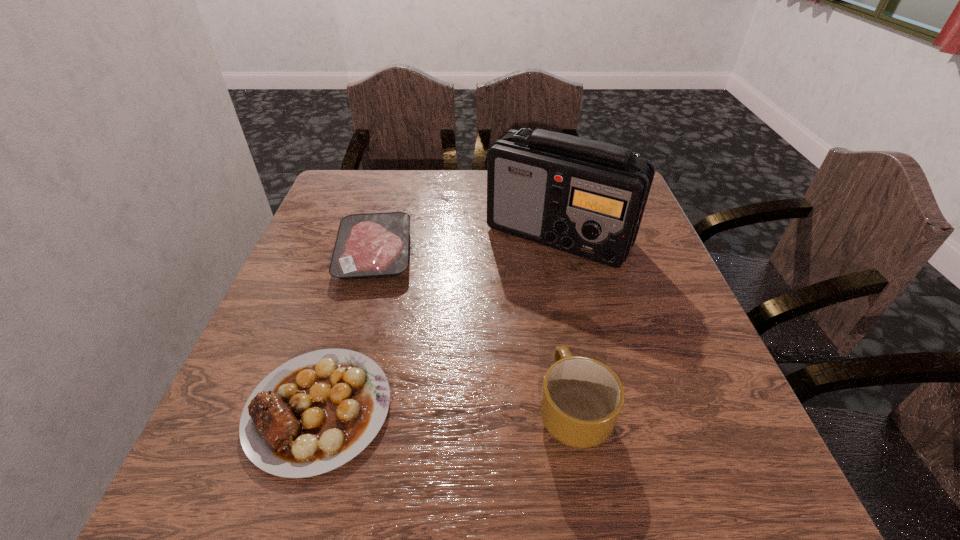
The width and height of the screenshot is (960, 540). In the image, there is a desktop. Find the location of `vacant area at the left edge`. vacant area at the left edge is located at coordinates point(308,265).

This screenshot has width=960, height=540. In the image, there is a desktop. Find the location of `free space at the right edge`. free space at the right edge is located at coordinates (685, 312).

In the image, there is a desktop. At what (x,y) coordinates should I click in order to perform the action: click on vacant space at the far left corner. Please return your answer as a coordinate pair (x, y). The height and width of the screenshot is (540, 960). Looking at the image, I should click on (357, 178).

Locate an element on the screen. This screenshot has width=960, height=540. vacant space at the near left corner is located at coordinates (234, 468).

Locate an element on the screen. Image resolution: width=960 pixels, height=540 pixels. unoccupied position between the radio receiver and the nearer steak is located at coordinates (439, 322).

Where is `free spot between the tallest object and the mug`? free spot between the tallest object and the mug is located at coordinates (565, 322).

The image size is (960, 540). What are the coordinates of `empty location between the farther steak and the third shortest object` in the screenshot? It's located at (473, 331).

Image resolution: width=960 pixels, height=540 pixels. I want to click on free point between the shorter steak and the second tallest object, so click(473, 331).

Find the location of a particular element. Image resolution: width=960 pixels, height=540 pixels. free space between the mug and the radio receiver is located at coordinates (565, 322).

You are a GUI agent. You are given a task and a screenshot of the screen. Output one action in this format:
    pyautogui.click(x=<x>, y=<y>)
    Task: Click on the vacant space in between the nearer steak and the shortest object
    The height and width of the screenshot is (540, 960).
    Given the screenshot: What is the action you would take?
    pyautogui.click(x=347, y=331)